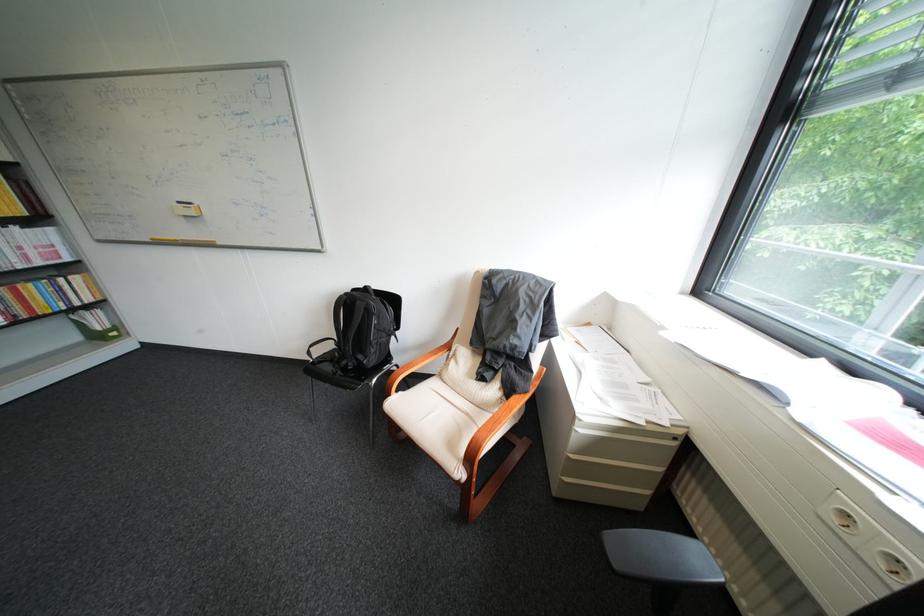
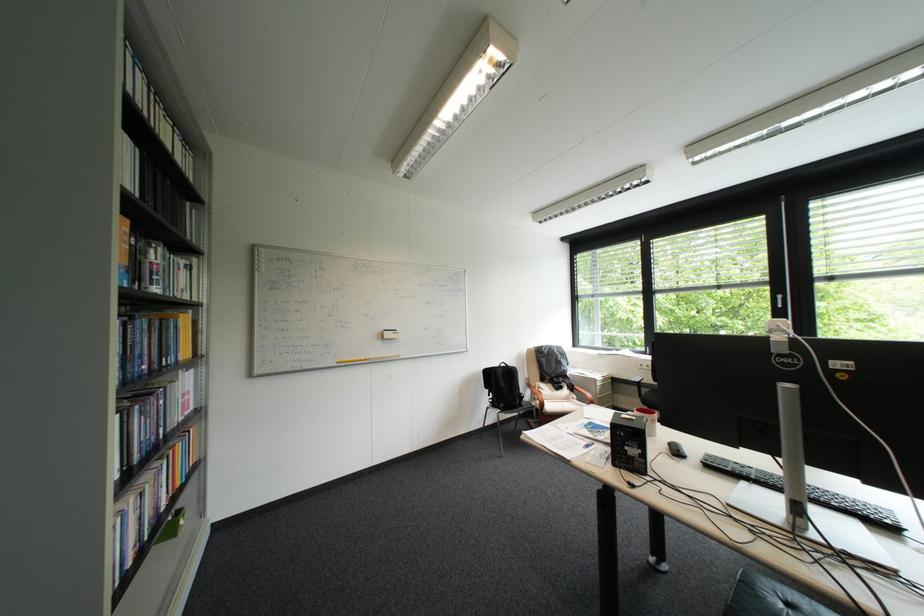
The point at (495, 384) is marked in the first image. Where is the corresponding point in the second image?

(573, 391)